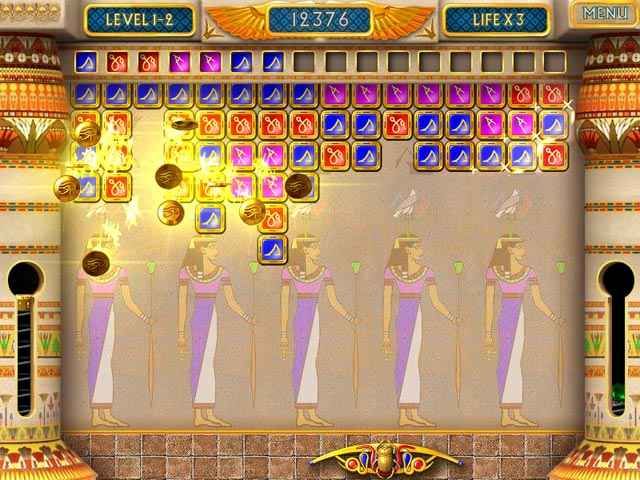
I want to click on column on left, so click(28, 232).